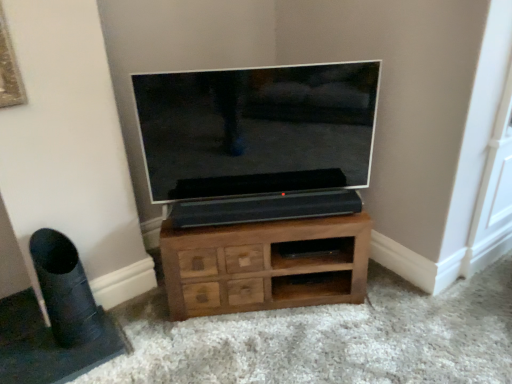
Question: Can you confirm if black matte speaker at lower left is thinner than flat screen tv at center?

Choices:
 (A) yes
 (B) no

Answer: (B)

Question: From the image's perspective, is black matte speaker at lower left under flat screen tv at center?

Choices:
 (A) yes
 (B) no

Answer: (A)

Question: Considering the relative sizes of black matte speaker at lower left and flat screen tv at center in the image provided, is black matte speaker at lower left bigger than flat screen tv at center?

Choices:
 (A) yes
 (B) no

Answer: (B)

Question: Is black matte speaker at lower left wider than flat screen tv at center?

Choices:
 (A) no
 (B) yes

Answer: (B)

Question: Is black matte speaker at lower left at the right side of flat screen tv at center?

Choices:
 (A) yes
 (B) no

Answer: (B)

Question: From the image's perspective, is black matte speaker at lower left above flat screen tv at center?

Choices:
 (A) no
 (B) yes

Answer: (A)

Question: Is flat screen tv at center not within black matte speaker at lower left?

Choices:
 (A) no
 (B) yes

Answer: (B)

Question: Is flat screen tv at center oriented towards black matte speaker at lower left?

Choices:
 (A) yes
 (B) no

Answer: (B)

Question: Can you confirm if flat screen tv at center is bigger than black matte speaker at lower left?

Choices:
 (A) no
 (B) yes

Answer: (B)

Question: Considering the relative positions of flat screen tv at center and black matte speaker at lower left in the image provided, is flat screen tv at center to the right of black matte speaker at lower left from the viewer's perspective?

Choices:
 (A) no
 (B) yes

Answer: (B)

Question: Is flat screen tv at center thinner than black matte speaker at lower left?

Choices:
 (A) no
 (B) yes

Answer: (B)

Question: Considering the relative sizes of flat screen tv at center and black matte speaker at lower left in the image provided, is flat screen tv at center wider than black matte speaker at lower left?

Choices:
 (A) yes
 (B) no

Answer: (B)

Question: Does brown wood chest of drawers at center have a lesser height compared to black matte speaker at lower left?

Choices:
 (A) yes
 (B) no

Answer: (A)